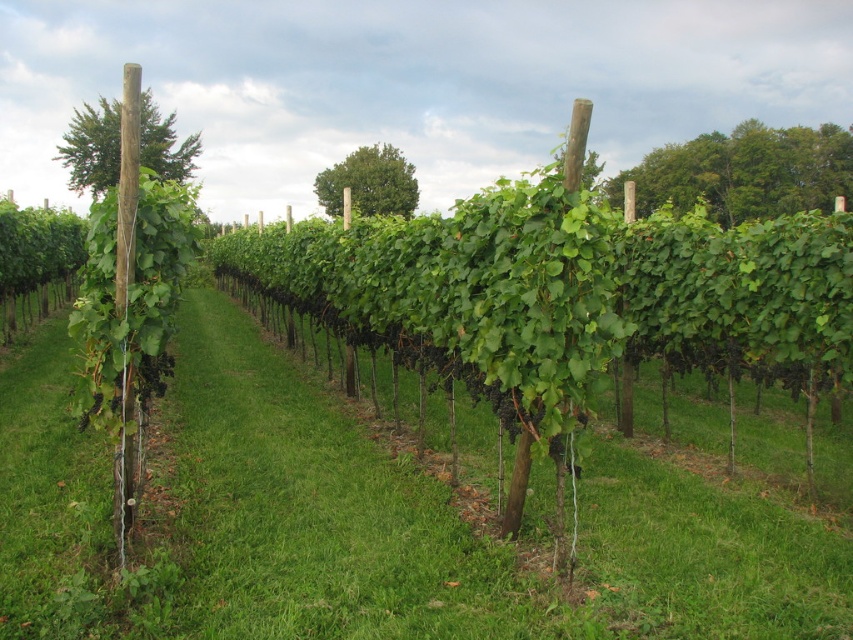
Question: Among these objects, which one is farthest from the camera?

Choices:
 (A) green leafy tree at upper right
 (B) green leafy tree at center
 (C) green leafy tree at upper left

Answer: (A)

Question: Among these points, which one is nearest to the camera?

Choices:
 (A) (160, 170)
 (B) (405, 204)

Answer: (A)

Question: Can you confirm if green leafy tree at upper right is positioned to the left of green leafy tree at upper left?

Choices:
 (A) yes
 (B) no

Answer: (B)

Question: Is green leafy tree at upper left thinner than green leafy tree at center?

Choices:
 (A) no
 (B) yes

Answer: (A)

Question: Which object is the closest to the green leafy tree at upper left?

Choices:
 (A) green leafy tree at upper right
 (B) green leafy tree at center

Answer: (B)

Question: Does green leafy tree at upper left appear on the right side of green leafy tree at center?

Choices:
 (A) no
 (B) yes

Answer: (A)